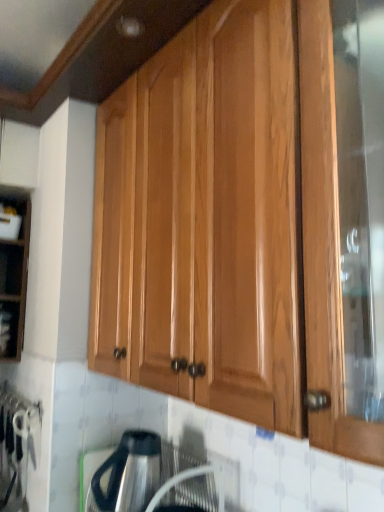
Question: From a real-world perspective, is glossy wood cabinet at upper center under satin silver kettle at lower center?

Choices:
 (A) yes
 (B) no

Answer: (B)

Question: Is glossy wood cabinet at upper center thinner than satin silver kettle at lower center?

Choices:
 (A) no
 (B) yes

Answer: (A)

Question: From the image's perspective, would you say glossy wood cabinet at upper center is positioned over satin silver kettle at lower center?

Choices:
 (A) yes
 (B) no

Answer: (A)

Question: Is satin silver kettle at lower center at the back of glossy wood cabinet at upper center?

Choices:
 (A) no
 (B) yes

Answer: (A)

Question: Does glossy wood cabinet at upper center have a greater height compared to satin silver kettle at lower center?

Choices:
 (A) yes
 (B) no

Answer: (A)

Question: Is glossy wood cabinet at upper center oriented towards satin silver kettle at lower center?

Choices:
 (A) no
 (B) yes

Answer: (A)

Question: Is glossy wood cabinet at upper center behind matte black shelf at left?

Choices:
 (A) yes
 (B) no

Answer: (B)

Question: Can you confirm if glossy wood cabinet at upper center is smaller than matte black shelf at left?

Choices:
 (A) yes
 (B) no

Answer: (B)

Question: Considering the relative sizes of glossy wood cabinet at upper center and matte black shelf at left in the image provided, is glossy wood cabinet at upper center wider than matte black shelf at left?

Choices:
 (A) no
 (B) yes

Answer: (B)

Question: Considering the relative positions of glossy wood cabinet at upper center and matte black shelf at left in the image provided, is glossy wood cabinet at upper center to the right of matte black shelf at left from the viewer's perspective?

Choices:
 (A) no
 (B) yes

Answer: (B)

Question: Can you confirm if glossy wood cabinet at upper center is thinner than matte black shelf at left?

Choices:
 (A) yes
 (B) no

Answer: (B)

Question: Can you confirm if glossy wood cabinet at upper center is bigger than matte black shelf at left?

Choices:
 (A) no
 (B) yes

Answer: (B)

Question: From a real-world perspective, is satin silver kettle at lower center below glossy wood cabinet at upper center?

Choices:
 (A) yes
 (B) no

Answer: (A)